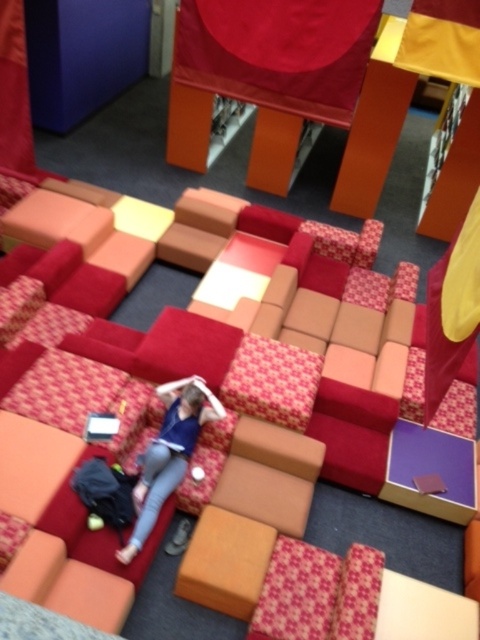
You are standing at the entrance of the seating area and want to find the textured fabric couch at center. According to the coordinates provided, where should you look relative to the entrance?

The textured fabric couch at center is located at coordinates point (351, 435), so you should look towards the lower right area of the seating area from the entrance.

You are standing in the seating area and want to move from point A to point B. Point A is at coordinates point (x=3, y=278) and point B is at coordinates point (x=148, y=476). Which point is closer to you when you start your journey?

Point A at coordinates point (x=3, y=278) is closer to you because it is further to the viewer than point B at coordinates point (x=148, y=476).